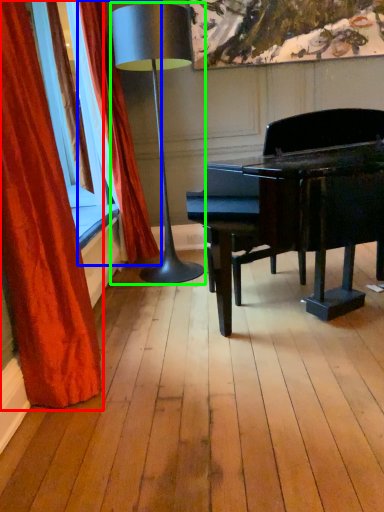
Question: Which is farther away from curtain (highlighted by a red box)? curtain (highlighted by a blue box) or lamp (highlighted by a green box)?

Choices:
 (A) curtain
 (B) lamp

Answer: (A)